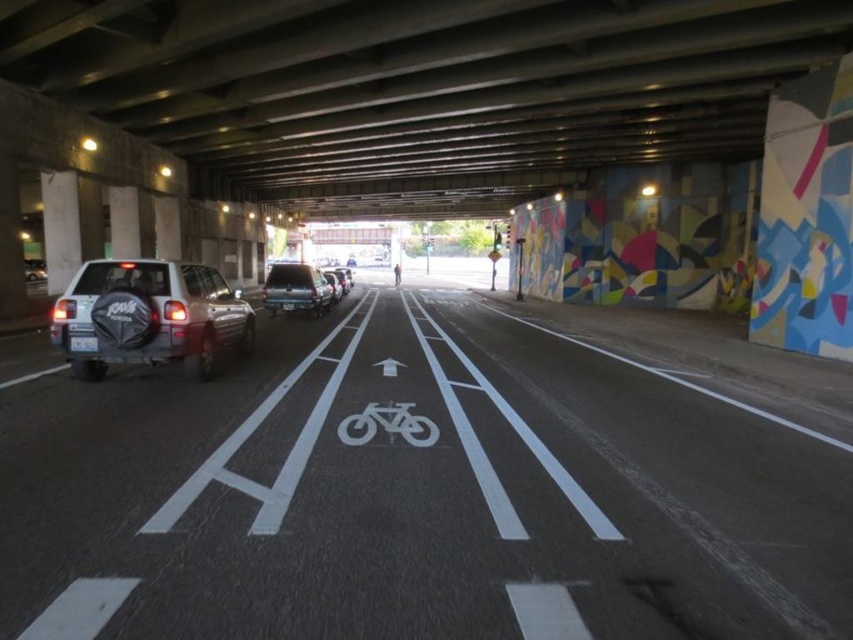
You are standing at the point labeled point (94,339). You want to take a photo of the bridge structure behind you. Is the distance between you and the camera sufficient to capture the entire bridge structure in one shot?

The distance between point (94,339) and the camera is 19.55 feet. Whether this distance is sufficient depends on the camera lens and field of view. However, the question does not provide information about the camera specifications, so we cannot definitively answer if the entire bridge structure can be captured in one shot.

You are a pedestrian standing on the sidewalk under the bridge. You see a white painted lines at center and a white plastic license plate at center. Which one is closer to you?

The white painted lines at center and white plastic license plate at center are 6.83 meters apart, but without additional information about their positions relative to the pedestrian, it is impossible to determine which is closer.